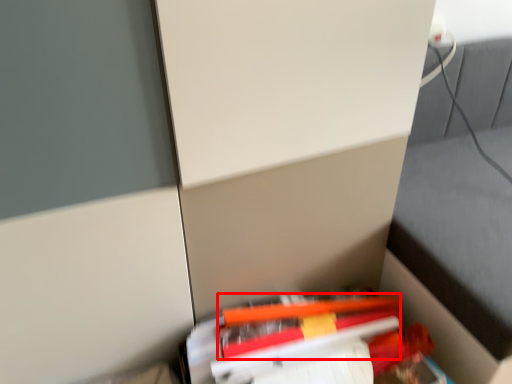
Question: From the image's perspective, where is pencil (annotated by the red box) located in relation to book in the image?

Choices:
 (A) above
 (B) below

Answer: (A)